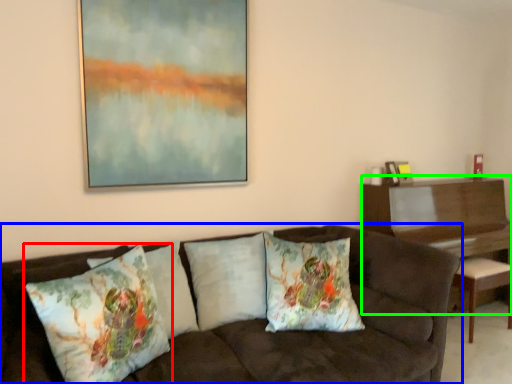
Question: Which object is positioned farthest from pillow (highlighted by a red box)? Select from studio couch (highlighted by a blue box) and table (highlighted by a green box).

Choices:
 (A) studio couch
 (B) table

Answer: (B)